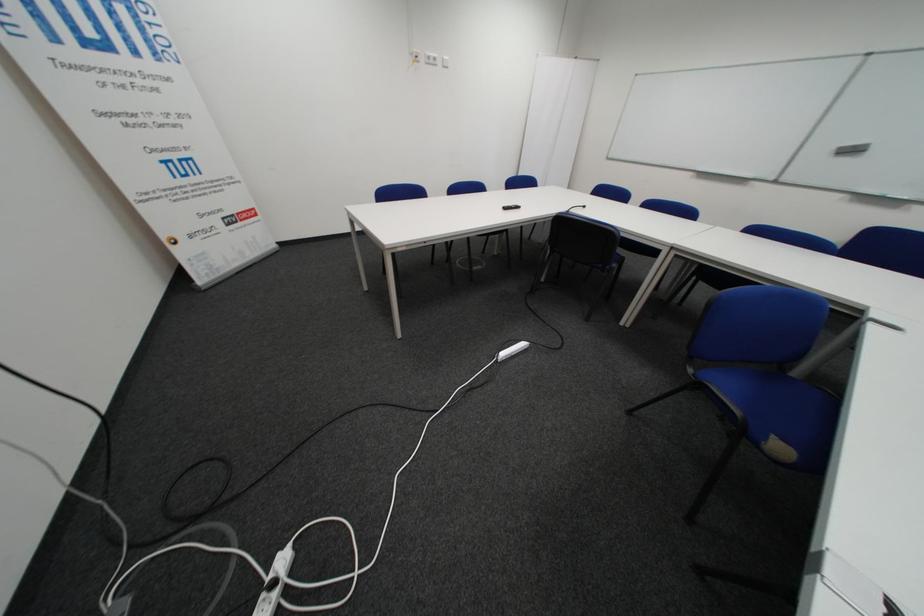
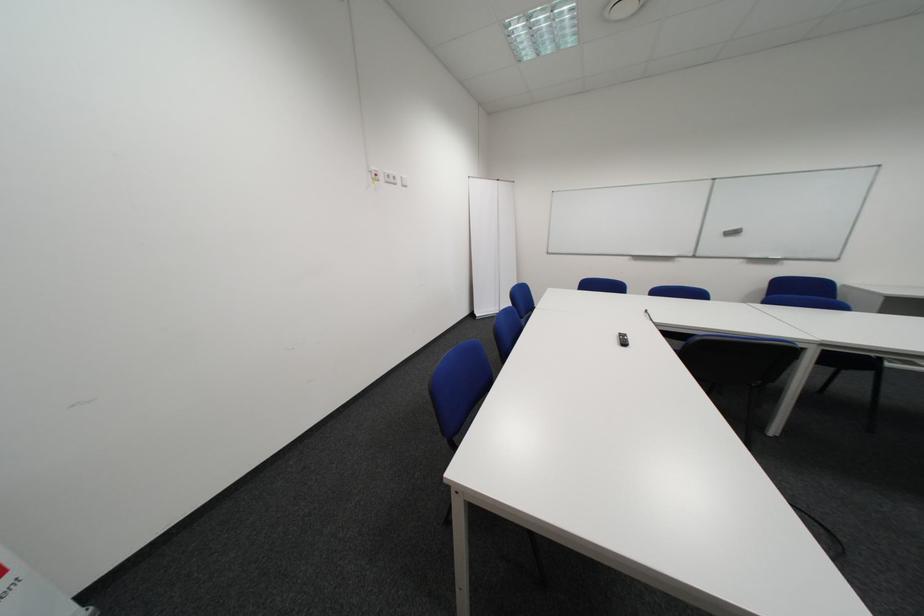
The point at (x=446, y=60) is marked in the first image. Where is the corresponding point in the second image?

(407, 179)